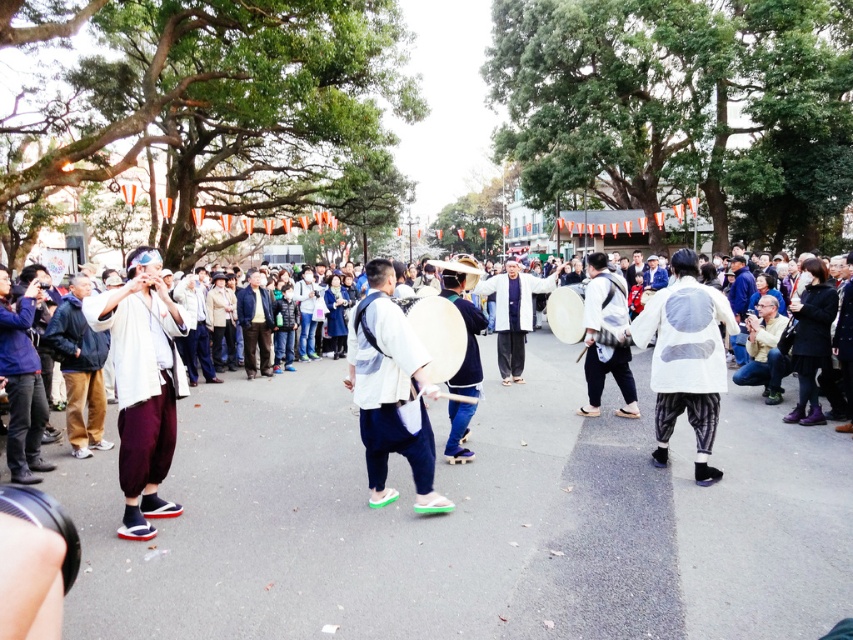
Question: Is white cotton kimono at left smaller than white matte drum at center?

Choices:
 (A) no
 (B) yes

Answer: (B)

Question: Considering the relative positions of white cotton drum at center and white matte drum at center in the image provided, where is white cotton drum at center located with respect to white matte drum at center?

Choices:
 (A) left
 (B) right

Answer: (B)

Question: Which point is farther to the camera?

Choices:
 (A) (120, 481)
 (B) (386, 262)

Answer: (B)

Question: Among these points, which one is nearest to the camera?

Choices:
 (A) (416, 444)
 (B) (566, 440)

Answer: (A)

Question: Is white cotton kimono at left positioned behind white matte drum at center?

Choices:
 (A) yes
 (B) no

Answer: (B)

Question: Based on their relative distances, which object is farther from the white cotton kimono at left?

Choices:
 (A) white cotton drum at center
 (B) white matte drum at center

Answer: (A)